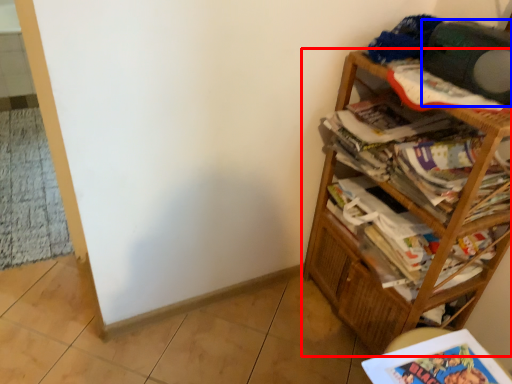
Question: Which point is closer to the camera, bookcase (highlighted by a red box) or speaker (highlighted by a blue box)?

Choices:
 (A) bookcase
 (B) speaker

Answer: (A)